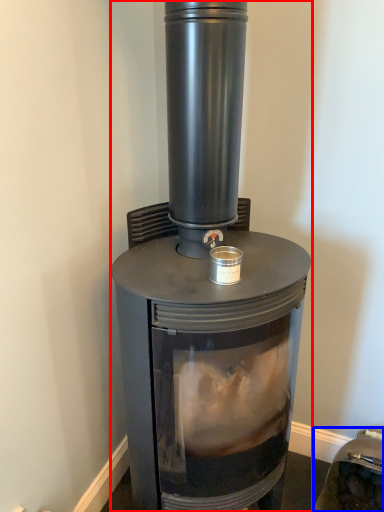
Question: Which object is further to the camera taking this photo, wood burning stove (highlighted by a red box) or appliance (highlighted by a blue box)?

Choices:
 (A) wood burning stove
 (B) appliance

Answer: (B)